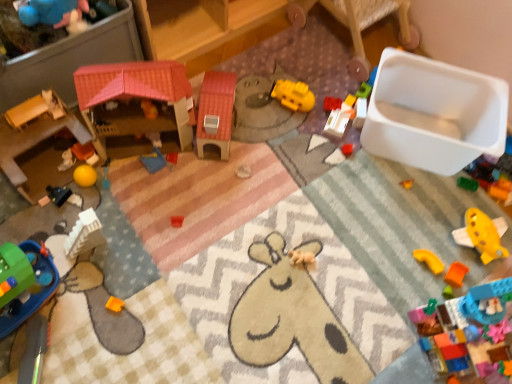
Where is `vacant area situated to the left side of yellow plastic block at upper center, the fifth toy from the right`? This screenshot has height=384, width=512. vacant area situated to the left side of yellow plastic block at upper center, the fifth toy from the right is located at coordinates (315, 102).